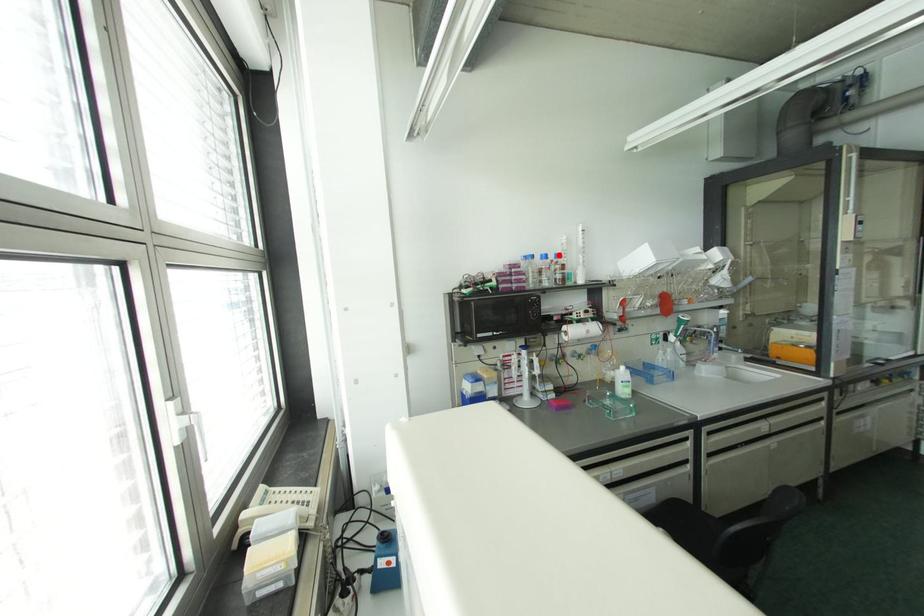
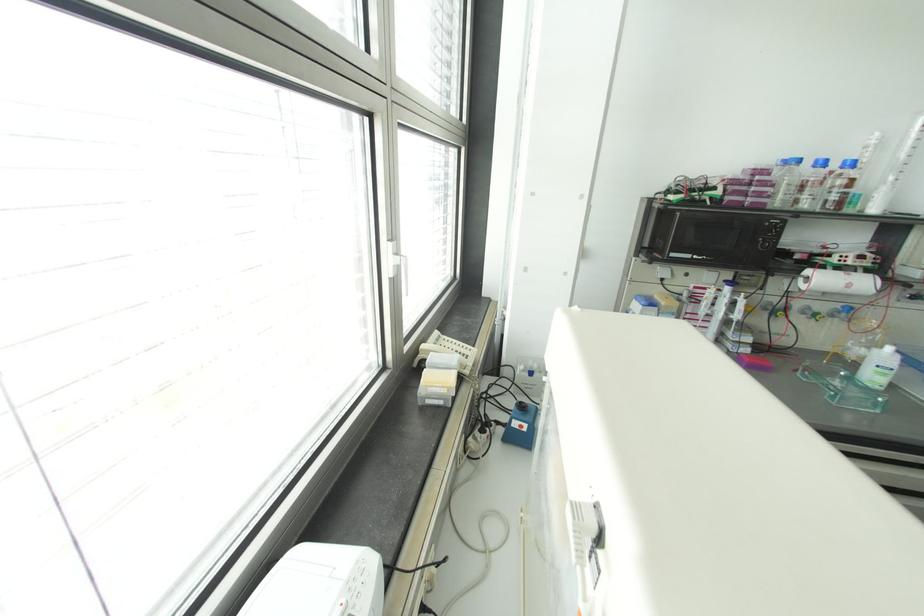
Question: I am providing you with two images of the same scene from different viewpoints. In image1, a red point is highlighted. Considering the same 3D point in image2, which of the following is correct?

Choices:
 (A) It is closer
 (B) It is farther

Answer: (B)